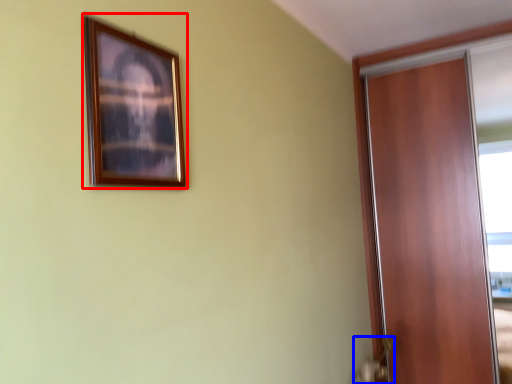
Question: Which of the following is the closest to the observer, picture frame (highlighted by a red box) or door handle (highlighted by a blue box)?

Choices:
 (A) picture frame
 (B) door handle

Answer: (A)